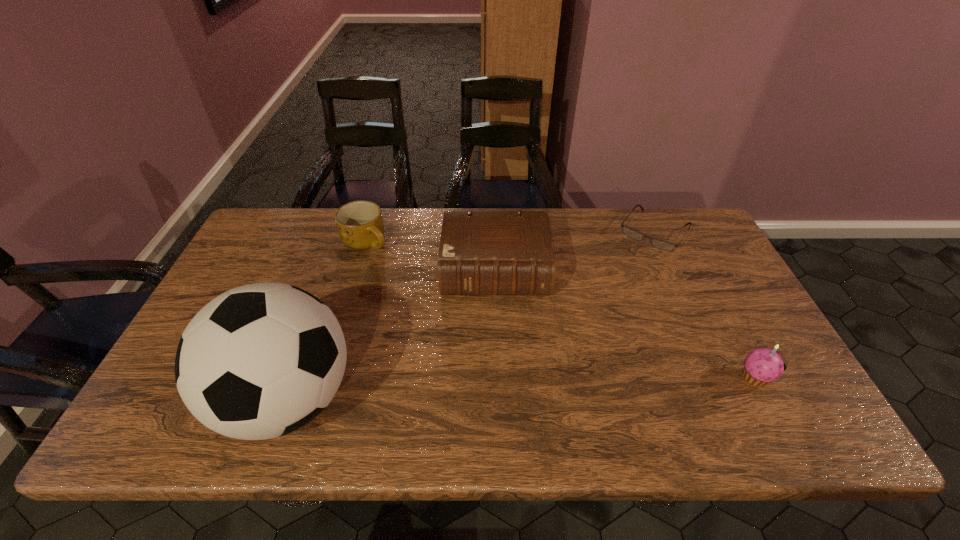
This screenshot has width=960, height=540. Find the location of `vacant space in between the shortest object and the cupcake`. vacant space in between the shortest object and the cupcake is located at coordinates (705, 305).

Locate an element on the screen. empty space between the tallest object and the cupcake is located at coordinates (522, 388).

Locate an element on the screen. vacant space that is in between the third object from left to right and the spectacles is located at coordinates (574, 252).

Locate an element on the screen. vacant area that lies between the cupcake and the soccer ball is located at coordinates (522, 388).

Locate an element on the screen. The image size is (960, 540). vacant space that's between the soccer ball and the third object from left to right is located at coordinates (392, 335).

Where is `free area in between the cupcake and the soccer ball`? The height and width of the screenshot is (540, 960). free area in between the cupcake and the soccer ball is located at coordinates (522, 388).

Identify the location of free space that is in between the mug and the cupcake. This screenshot has width=960, height=540. (561, 310).

Image resolution: width=960 pixels, height=540 pixels. I want to click on free space between the shortest object and the tallest object, so click(471, 315).

Where is `empty space between the soccer ball and the cupcake`? The image size is (960, 540). empty space between the soccer ball and the cupcake is located at coordinates (522, 388).

Locate an element on the screen. object that is the third closest one to the third object from right to left is located at coordinates (659, 244).